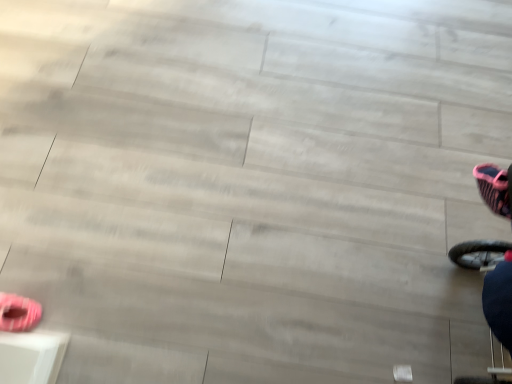
Question: Should I look upward or downward to see pink striped fabric shoe at lower left?

Choices:
 (A) up
 (B) down

Answer: (B)